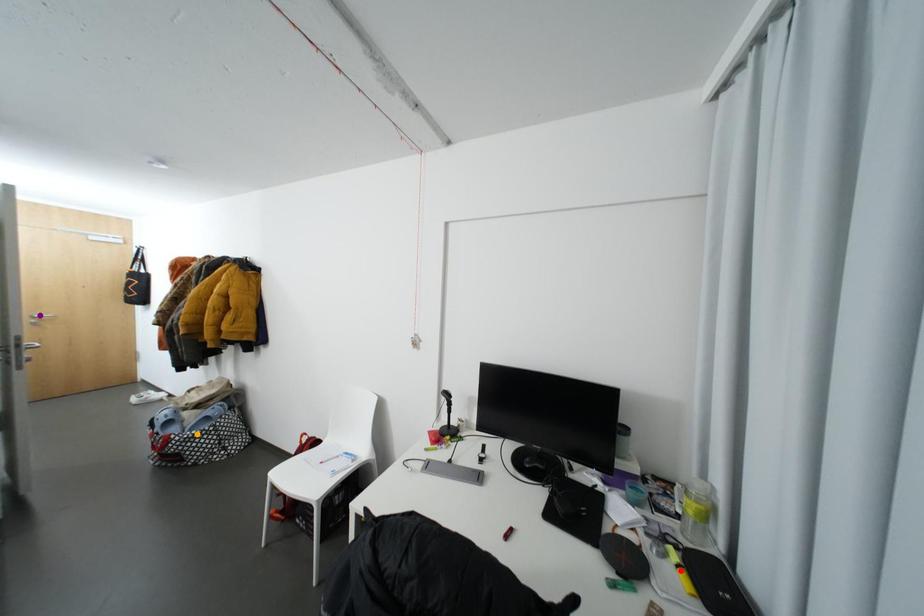
Order these from nearest to farthest:
A) red point
B) purple point
C) orange point

orange point → purple point → red point